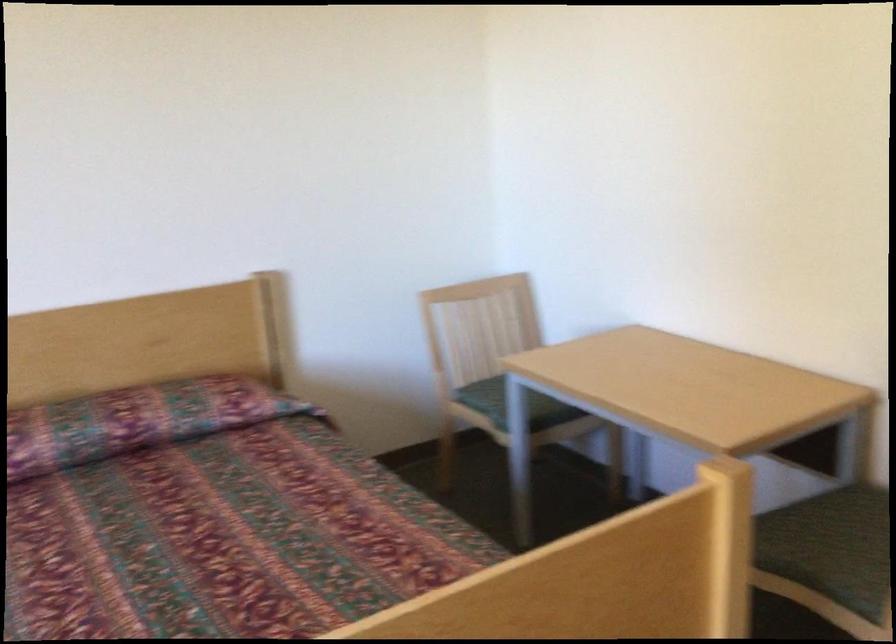
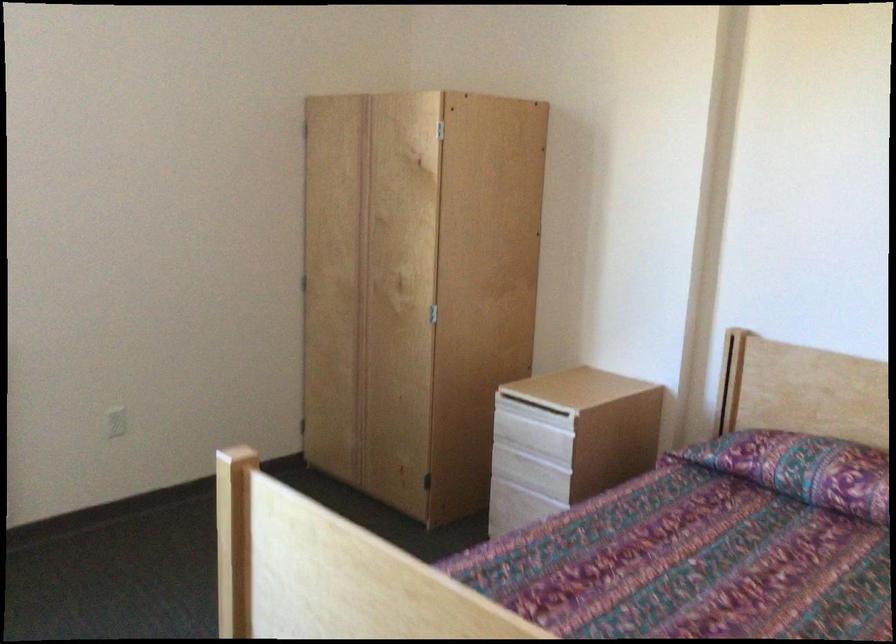
Question: The camera is either moving clockwise (left) or counter-clockwise (right) around the object. The first image is from the beginning of the video and the second image is from the end. Is the camera moving left or right when shooting the video?

Choices:
 (A) Left
 (B) Right

Answer: (B)